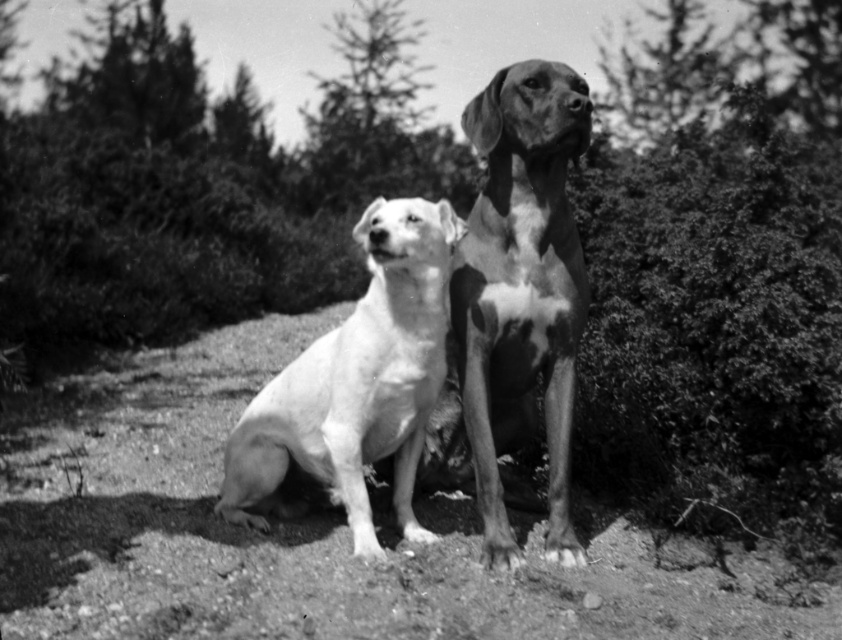
You are a photographer trying to capture both dogs in the scene. Given that the spotted fur dog at center is positioned at coordinates point 0.453, 0.620, where should you focus your camera to ensure both dogs are in the frame?

To ensure both dogs are in the frame, focus the camera at the position of the spotted fur dog at center, which is at point (x=521, y=289), as this central position will help include both dogs in the photograph.

You are a photographer trying to capture both the spotted fur dog at center and the white smooth dog at center in a single shot. Which dog should you focus on first to ensure both are in clear view?

You should focus on the spotted fur dog at center first because it is closer to you than the white smooth dog at center, ensuring both will be in clear view when focused on the closer subject.